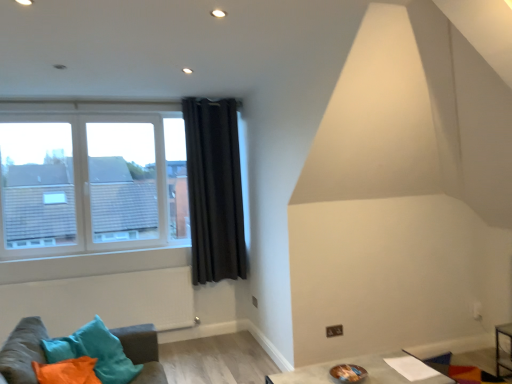
Find the location of a particular element. This screenshot has height=384, width=512. smooth gray table at lower center is located at coordinates (359, 365).

At what (x,y) coordinates should I click in order to perform the action: click on velvet teal cushions at lower left. Please return your answer as a coordinate pair (x, y). This screenshot has width=512, height=384. Looking at the image, I should click on (23, 351).

Where is `black velvet curtain at upper center`? black velvet curtain at upper center is located at coordinates (214, 190).

Locate an element on the screen. Image resolution: width=512 pixels, height=384 pixels. clear glass window at left is located at coordinates (81, 184).

From a real-world perspective, between velvet teal cushions at lower left and smooth gray table at lower center, who is vertically lower?

In real-world perspective, smooth gray table at lower center is lower.

How distant is velvet teal cushions at lower left from smooth gray table at lower center?

A distance of 1.08 meters exists between velvet teal cushions at lower left and smooth gray table at lower center.

From the image's perspective, is velvet teal cushions at lower left below smooth gray table at lower center?

Incorrect, from the image's perspective, velvet teal cushions at lower left is higher than smooth gray table at lower center.

Are velvet teal cushions at lower left and smooth gray table at lower center making contact?

No.

How much distance is there between smooth gray table at lower center and black velvet curtain at upper center?

smooth gray table at lower center is 6.69 feet from black velvet curtain at upper center.

Consider the image. Who is bigger, smooth gray table at lower center or black velvet curtain at upper center?

smooth gray table at lower center.

Which point is more forward, (392, 369) or (228, 162)?

The point (392, 369) is closer to the camera.

Would you say black velvet curtain at upper center is part of smooth gray table at lower center's contents?

Definitely not — black velvet curtain at upper center is not inside smooth gray table at lower center.

Visually, is smooth gray table at lower center positioned to the left or to the right of clear glass window at left?

smooth gray table at lower center is to the right of clear glass window at left.

Consider the image. Is smooth gray table at lower center not inside clear glass window at left?

That's correct, smooth gray table at lower center is outside of clear glass window at left.

The width and height of the screenshot is (512, 384). Identify the location of bay window to the left of smooth gray table at lower center. (81, 184).

From the picture: Can you confirm if clear glass window at left is taller than velvet teal cushions at lower left?

Correct, clear glass window at left is much taller as velvet teal cushions at lower left.

In terms of width, does clear glass window at left look wider or thinner when compared to velvet teal cushions at lower left?

clear glass window at left is thinner than velvet teal cushions at lower left.

Which point is more distant from viewer, (101, 123) or (151, 339)?

Positioned behind is point (101, 123).

Who is more distant, clear glass window at left or velvet teal cushions at lower left?

clear glass window at left is further away from the camera.

Considering the sizes of velvet teal cushions at lower left and clear glass window at left in the image, is velvet teal cushions at lower left taller or shorter than clear glass window at left?

velvet teal cushions at lower left is shorter than clear glass window at left.

Does velvet teal cushions at lower left have a lesser width compared to clear glass window at left?

No.

Consider the image. Considering the relative positions of velvet teal cushions at lower left and clear glass window at left in the image provided, is velvet teal cushions at lower left in front of clear glass window at left?

Yes, velvet teal cushions at lower left is closer to the viewer.

From the image's perspective, is smooth gray table at lower center located beneath velvet teal cushions at lower left?

Yes, from the image's perspective, smooth gray table at lower center is below velvet teal cushions at lower left.

Locate an element on the screen. table behind the velvet teal cushions at lower left is located at coordinates (359, 365).

Is point (349, 360) closer to viewer compared to point (20, 348)?

No, (349, 360) is behind (20, 348).

From the image's perspective, between black velvet curtain at upper center and smooth gray table at lower center, who is located below?

smooth gray table at lower center.

Which is more distant, (228, 106) or (309, 366)?

The point (228, 106) is behind.

Does black velvet curtain at upper center have a lesser height compared to smooth gray table at lower center?

In fact, black velvet curtain at upper center may be taller than smooth gray table at lower center.

Can you see black velvet curtain at upper center touching smooth gray table at lower center?

black velvet curtain at upper center and smooth gray table at lower center are clearly separated.

Image resolution: width=512 pixels, height=384 pixels. In the image, there is a velvet teal cushions at lower left. What are the coordinates of `table below it (from a real-world perspective)` in the screenshot? It's located at (359, 365).

Locate an element on the screen. The image size is (512, 384). table below the black velvet curtain at upper center (from the image's perspective) is located at coordinates (x=359, y=365).

Estimate the real-world distances between objects in this image. Which object is further from black velvet curtain at upper center, smooth gray table at lower center or velvet teal cushions at lower left?

smooth gray table at lower center lies further to black velvet curtain at upper center than the other object.

When comparing their distances from smooth gray table at lower center, does black velvet curtain at upper center or clear glass window at left seem further?

Based on the image, clear glass window at left appears to be further to smooth gray table at lower center.

Looking at the image, which one is located closer to clear glass window at left, black velvet curtain at upper center or smooth gray table at lower center?

Among the two, black velvet curtain at upper center is located nearer to clear glass window at left.

Looking at the image, which one is located closer to clear glass window at left, smooth gray table at lower center or black velvet curtain at upper center?

The object closer to clear glass window at left is black velvet curtain at upper center.

Considering their positions, is clear glass window at left positioned closer to smooth gray table at lower center than black velvet curtain at upper center?

black velvet curtain at upper center is positioned closer to the anchor smooth gray table at lower center.

Which object lies nearer to the anchor point smooth gray table at lower center, velvet teal cushions at lower left or black velvet curtain at upper center?

Based on the image, velvet teal cushions at lower left appears to be nearer to smooth gray table at lower center.

Looking at the image, which one is located further to clear glass window at left, velvet teal cushions at lower left or smooth gray table at lower center?

smooth gray table at lower center.

Estimate the real-world distances between objects in this image. Which object is closer to clear glass window at left, smooth gray table at lower center or velvet teal cushions at lower left?

velvet teal cushions at lower left lies closer to clear glass window at left than the other object.

Locate an element on the screen. Image resolution: width=512 pixels, height=384 pixels. table located between velvet teal cushions at lower left and black velvet curtain at upper center in the depth direction is located at coordinates (359, 365).

Image resolution: width=512 pixels, height=384 pixels. I want to click on bay window between velvet teal cushions at lower left and black velvet curtain at upper center along the z-axis, so click(81, 184).

At what (x,y) coordinates should I click in order to perform the action: click on curtain between clear glass window at left and smooth gray table at lower center. Please return your answer as a coordinate pair (x, y). The image size is (512, 384). Looking at the image, I should click on (214, 190).

This screenshot has height=384, width=512. Find the location of `studio couch between clear glass window at left and smooth gray table at lower center in the horizontal direction`. studio couch between clear glass window at left and smooth gray table at lower center in the horizontal direction is located at coordinates (23, 351).